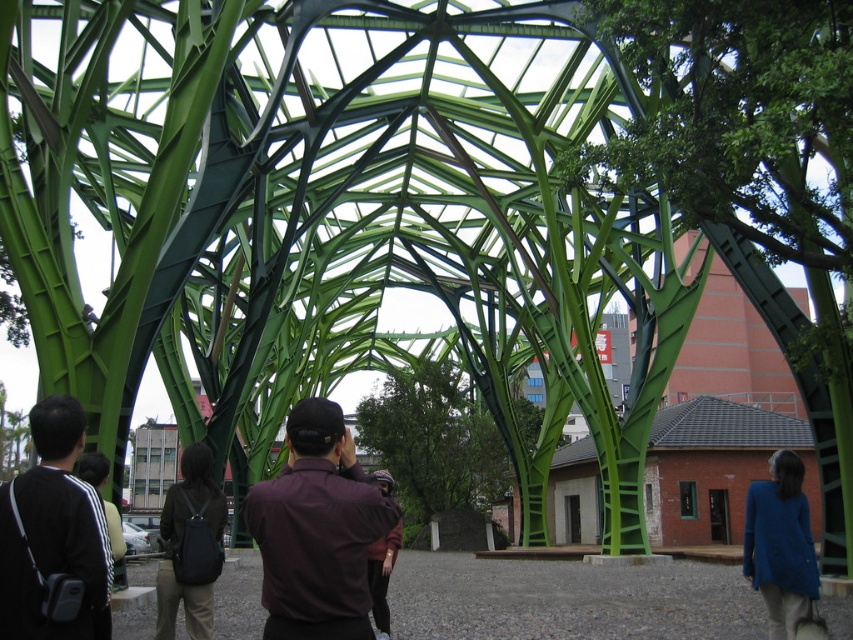
Which is more to the right, maroon fabric shirt at center or dark gray fabric jacket at lower left?

maroon fabric shirt at center

Is maroon fabric shirt at center positioned behind dark gray fabric jacket at lower left?

Yes, maroon fabric shirt at center is further from the viewer.

This screenshot has height=640, width=853. I want to click on maroon fabric shirt at center, so click(x=317, y=529).